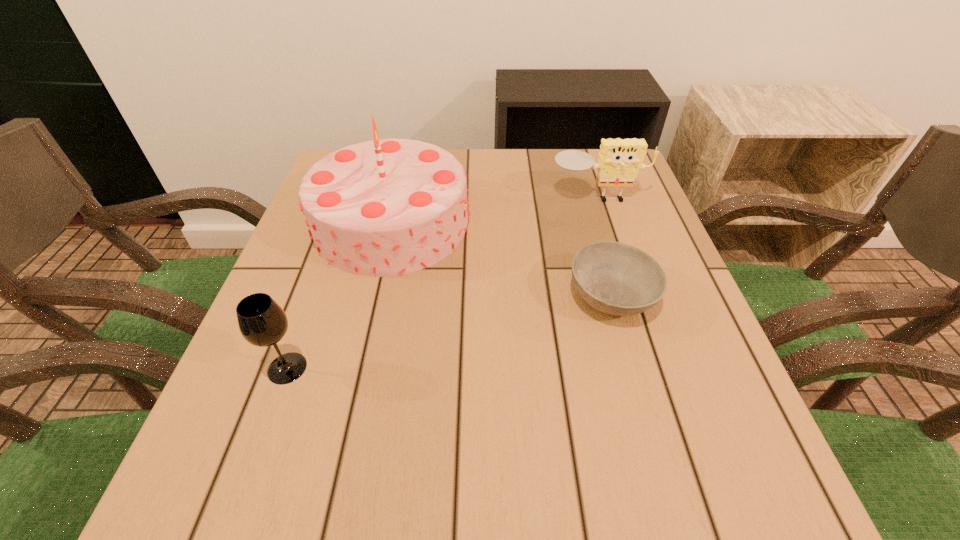
Find the location of `birthday cake present at the left edge`. birthday cake present at the left edge is located at coordinates (385, 207).

This screenshot has height=540, width=960. Find the location of `wineglass located at the left edge`. wineglass located at the left edge is located at coordinates (262, 322).

Where is `sponge located in the right edge section of the desktop`? This screenshot has width=960, height=540. sponge located in the right edge section of the desktop is located at coordinates (619, 161).

Identify the location of bowl located at the right edge. The width and height of the screenshot is (960, 540). (615, 278).

Identify the location of object at the far left corner. (385, 207).

Find the location of a particular element. object located in the far right corner section of the desktop is located at coordinates (619, 161).

Locate an element on the screen. This screenshot has height=540, width=960. vacant region at the far edge of the desktop is located at coordinates (562, 191).

In the image, there is a desktop. In order to click on vacant space at the left edge in this screenshot , I will do `click(329, 358)`.

This screenshot has width=960, height=540. I want to click on vacant area at the right edge of the desktop, so click(618, 318).

The image size is (960, 540). I want to click on vacant space that's between the wineglass and the bowl, so click(x=449, y=332).